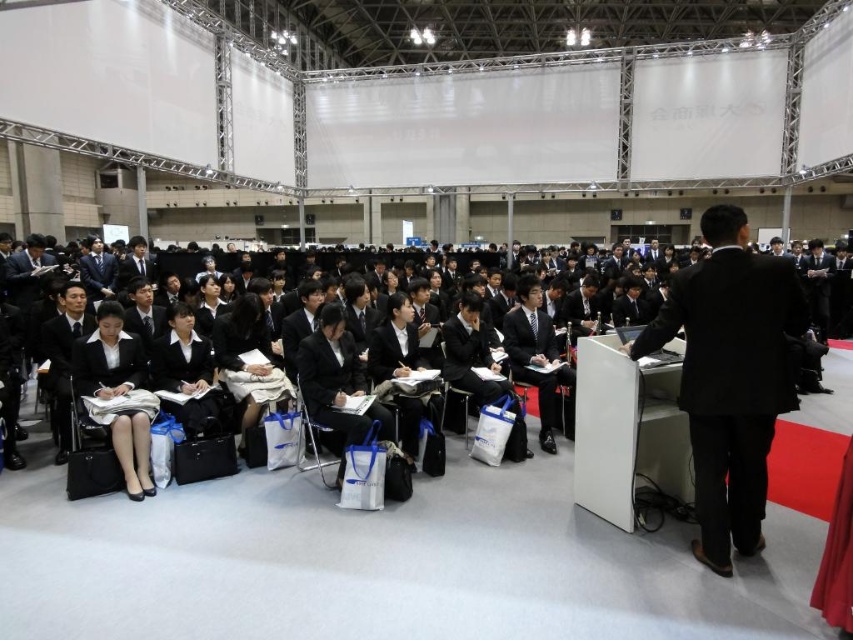
Does black smooth suit at right appear over black fabric skirt at lower left?

Correct, black smooth suit at right is located above black fabric skirt at lower left.

Is black smooth suit at right to the left of black fabric skirt at lower left from the viewer's perspective?

No, black smooth suit at right is not to the left of black fabric skirt at lower left.

What do you see at coordinates (730, 385) in the screenshot?
I see `black smooth suit at right` at bounding box center [730, 385].

In order to click on black smooth suit at right in this screenshot , I will do `click(730, 385)`.

Which is behind, point (715, 248) or point (51, 371)?

Positioned behind is point (51, 371).

Which is more to the left, black smooth suit at right or black matte suit at left?

black matte suit at left

Which is behind, point (695, 490) or point (62, 349)?

The point (62, 349) is behind.

Identify the location of black smooth suit at right. (730, 385).

Who is more distant from viewer, (x=735, y=420) or (x=357, y=388)?

The point (x=357, y=388) is behind.

Does black smooth suit at right have a lesser height compared to black matte suit at center?

No.

This screenshot has width=853, height=640. I want to click on black smooth suit at right, so click(x=730, y=385).